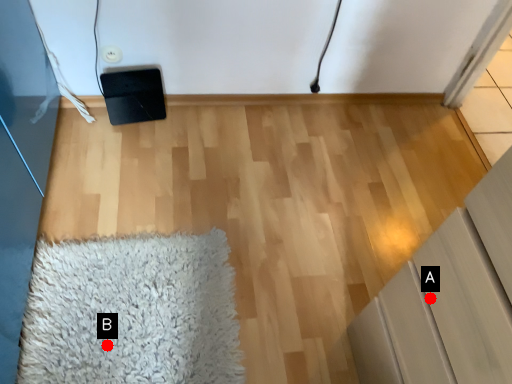
Question: Two points are circled on the image, labeled by A and B beside each circle. Which point is closer to the camera?

Choices:
 (A) A is closer
 (B) B is closer

Answer: (A)